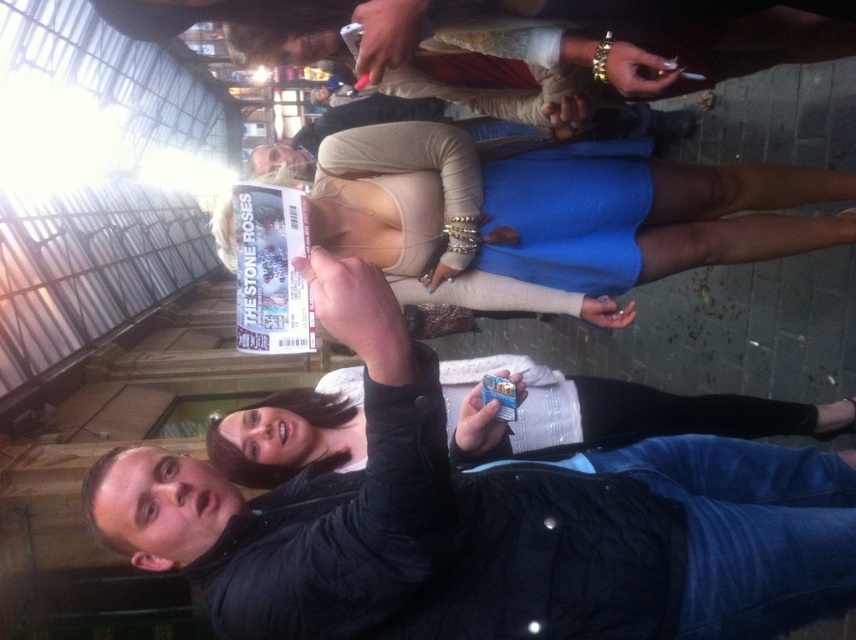
Does matte blue dress at center appear under matte black jacket at upper center?

Indeed, matte blue dress at center is positioned under matte black jacket at upper center.

Find the location of a particular element. The image size is (856, 640). matte blue dress at center is located at coordinates click(x=557, y=218).